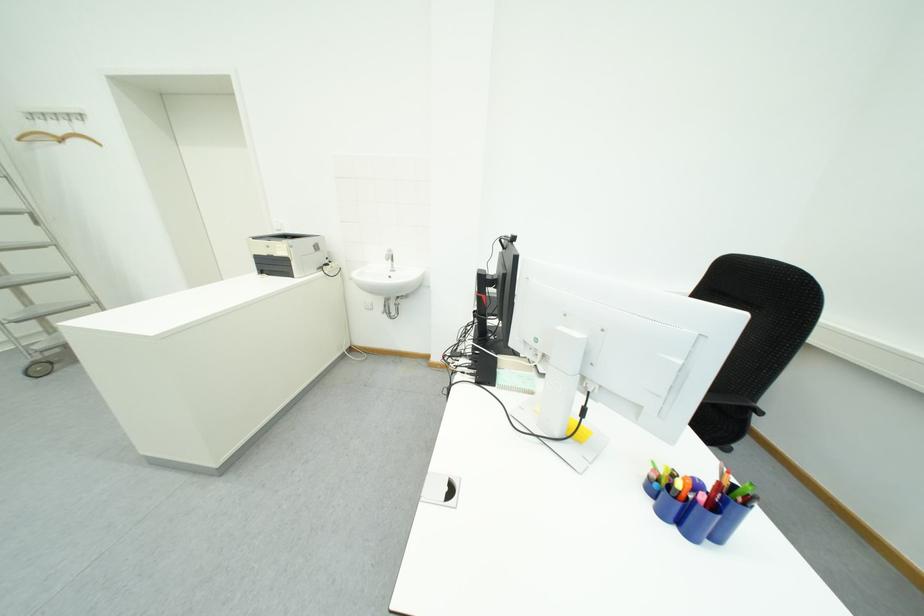
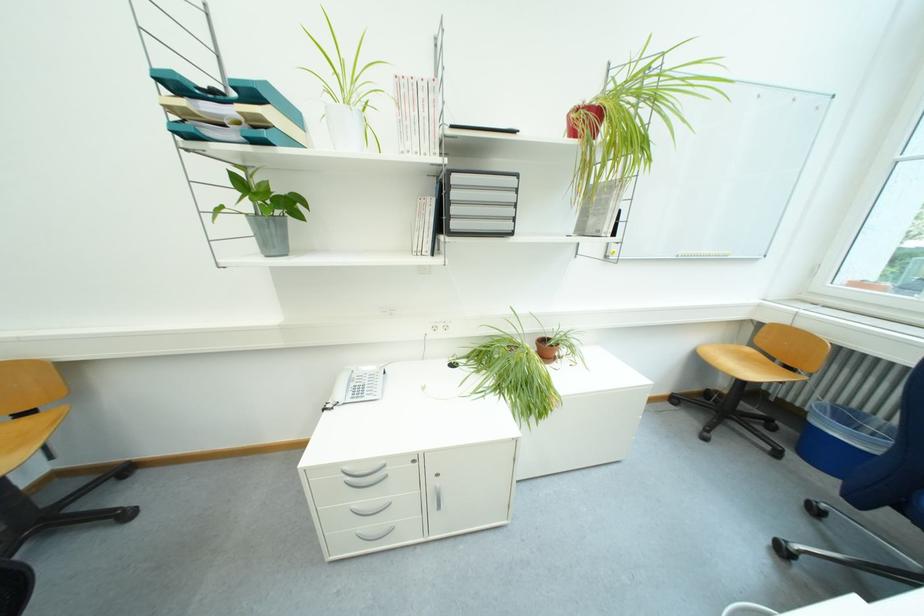
The first image is from the beginning of the video and the second image is from the end. How did the camera likely rotate when shooting the video?

The camera rotated toward right-down.